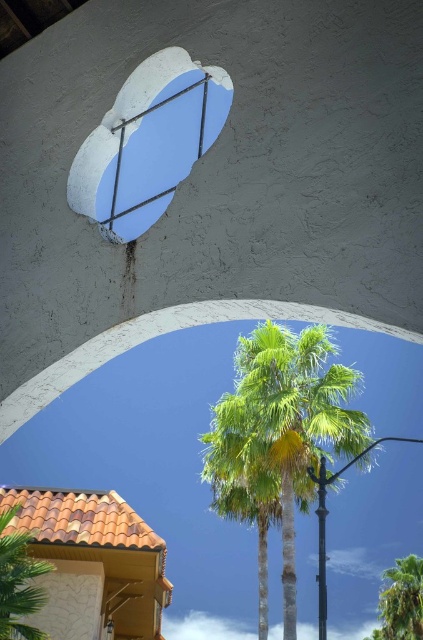
You are standing in front of the white concrete window at upper center and want to see the green leafy palm tree at center. Can you see it through the window?

The green leafy palm tree at center is further to the viewer than the white concrete window at upper center, so you cannot see it through the window because it is in front of the window.

You are standing in front of an architectural structure with a white concrete archway at center. If you want to touch the archway, how many steps do you need to take forward if each step covers approximately 0.75 meters?

The white concrete archway at center is 3.37 meters away. Since each step covers 0.75 meters, you would need to take approximately 5 steps forward to reach it. However, 5 steps would cover 3.75 meters, which is slightly more than the distance. To be precise, 4 steps would cover 3 meters, leaving 0.37 meters remaining. Therefore, you would need to take 4 full steps and then a small step of about 0.37 meters to reach the archway.

You are a landscape architect designing a garden pathway between the green leafy palm at lower left and the green leafy palm tree at lower right. Which palm should you place closer to the entrance to make the pathway appear more balanced?

To create a balanced pathway, place the green leafy palm at lower left closer to the entrance since it is smaller than the green leafy palm tree at lower right. This arrangement balances their sizes by positioning the smaller palm where it can be seen first, creating visual harmony.